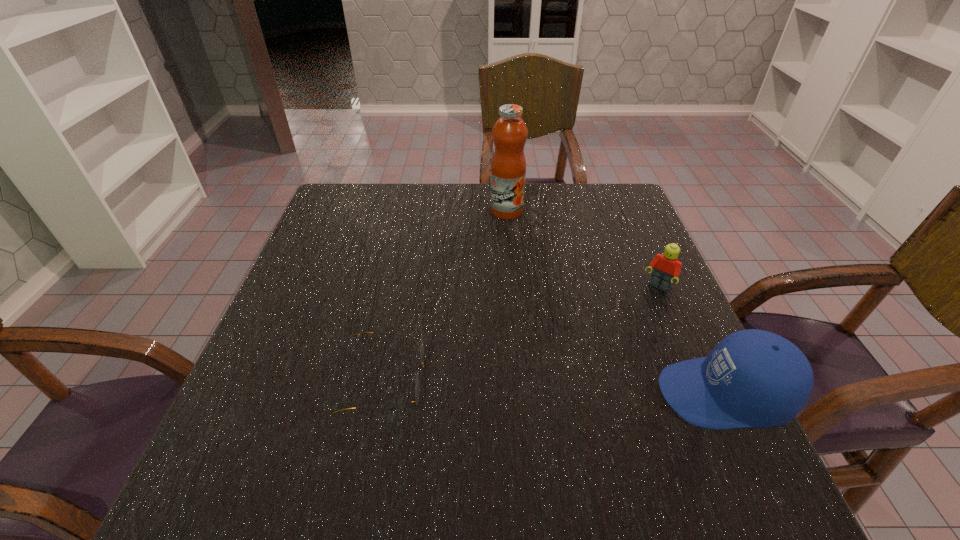
Identify the location of the leftmost object. (422, 348).

Locate an element on the screen. The height and width of the screenshot is (540, 960). spectacles is located at coordinates (422, 348).

Where is `cap`? cap is located at coordinates (753, 378).

At what (x,y) coordinates should I click in order to perform the action: click on the farthest object. Please return your answer as a coordinate pair (x, y). Looking at the image, I should click on (508, 167).

Where is `the tallest object`? the tallest object is located at coordinates (508, 167).

Locate an element on the screen. Lego is located at coordinates (667, 267).

Where is `vacant space located on the temples of the spectacles`? vacant space located on the temples of the spectacles is located at coordinates (477, 379).

Image resolution: width=960 pixels, height=540 pixels. Find the location of `free space located on the front-facing side of the cap`. free space located on the front-facing side of the cap is located at coordinates (616, 394).

This screenshot has height=540, width=960. In order to click on free space located on the front-facing side of the cap in this screenshot , I will do `click(515, 394)`.

Find the location of a particular element. The width and height of the screenshot is (960, 540). vacant space located on the front-facing side of the cap is located at coordinates (510, 394).